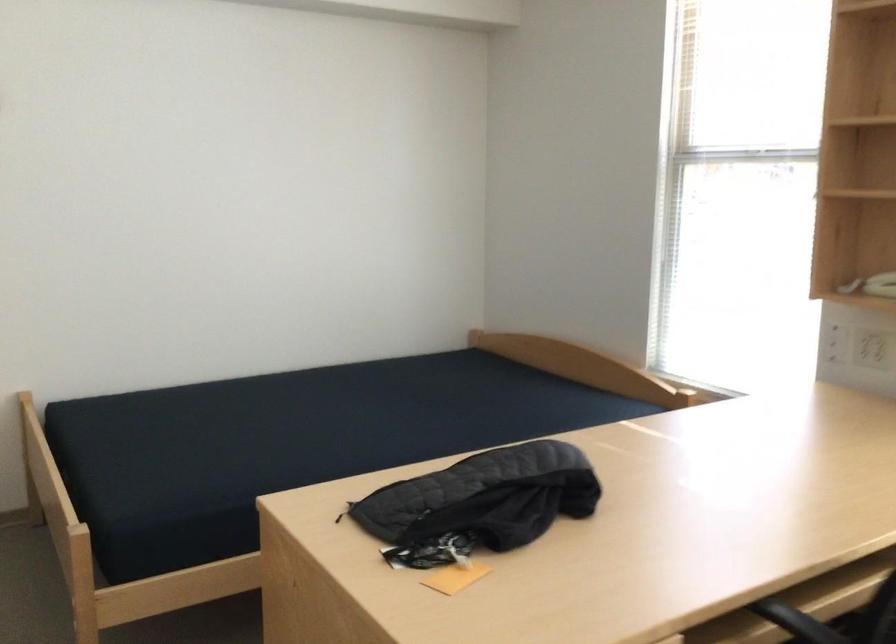
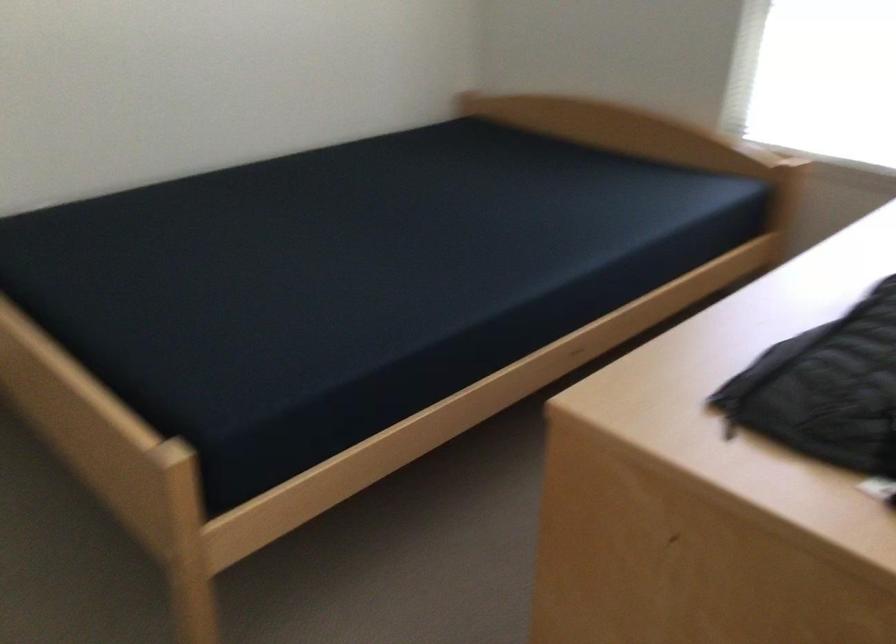
The point at (304,435) is marked in the first image. Where is the corresponding point in the second image?

(362, 256)